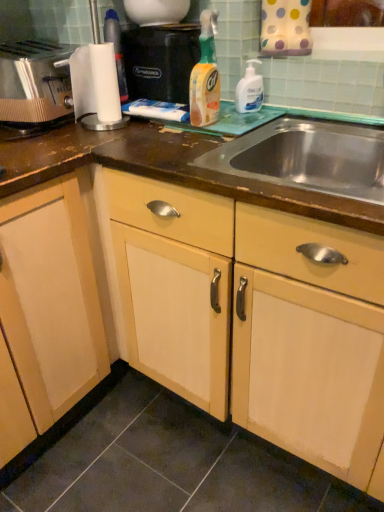
In order to face stainless steel sink at center, should I rotate leftwards or rightwards?

You should look right and rotate roughly 16.664 degrees.

Measure the distance between point (173, 315) and camera.

Point (173, 315) is 3.94 feet from camera.

Describe the element at coordinates (34, 82) in the screenshot. I see `brushed metal toaster at left` at that location.

What do you see at coordinates (160, 61) in the screenshot? I see `black plastic coffee machine at upper center` at bounding box center [160, 61].

The height and width of the screenshot is (512, 384). I want to click on white glossy pump bottle at upper right, which ranks as the 2th cleaning product in left-to-right order, so click(250, 90).

At what (x,y) coordinates should I click in order to perform the action: click on stainless steel sink at center. Please return your answer as a coordinate pair (x, y). This screenshot has width=384, height=512. Looking at the image, I should click on (306, 158).

Considering the sizes of translucent plastic spray bottle at center, which is the second cleaning product from right to left, and black plastic coffee machine at upper center in the image, is translucent plastic spray bottle at center, which is the second cleaning product from right to left, taller or shorter than black plastic coffee machine at upper center?

Clearly, translucent plastic spray bottle at center, which is the second cleaning product from right to left, is taller compared to black plastic coffee machine at upper center.

The height and width of the screenshot is (512, 384). What are the coordinates of `coffee machine on the left of translucent plastic spray bottle at center, arranged as the first cleaning product when viewed from the left` in the screenshot? It's located at (160, 61).

Which object is positioned more to the right, translucent plastic spray bottle at center, arranged as the first cleaning product when viewed from the left, or black plastic coffee machine at upper center?

translucent plastic spray bottle at center, arranged as the first cleaning product when viewed from the left.

Considering the positions of objects translucent plastic spray bottle at center, which is the second cleaning product from right to left, and black plastic coffee machine at upper center in the image provided, who is behind, translucent plastic spray bottle at center, which is the second cleaning product from right to left, or black plastic coffee machine at upper center?

black plastic coffee machine at upper center is behind.

Considering the relative sizes of black plastic coffee machine at upper center and brushed metal toaster at left in the image provided, is black plastic coffee machine at upper center wider than brushed metal toaster at left?

Incorrect, the width of black plastic coffee machine at upper center does not surpass that of brushed metal toaster at left.

Could you tell me if black plastic coffee machine at upper center is turned towards brushed metal toaster at left?

No, black plastic coffee machine at upper center is not turned towards brushed metal toaster at left.

Is black plastic coffee machine at upper center positioned before brushed metal toaster at left?

No, it is not.

From the image's perspective, between black plastic coffee machine at upper center and brushed metal toaster at left, who is located below?

brushed metal toaster at left is shown below in the image.

How many degrees apart are the facing directions of matte wood cabinet at center and stainless steel sink at center?

The angular difference between matte wood cabinet at center and stainless steel sink at center is 0.000668 degrees.

Locate an element on the screen. The image size is (384, 512). sink behind the matte wood cabinet at center is located at coordinates (306, 158).

Considering the positions of objects matte wood cabinet at center and stainless steel sink at center in the image provided, who is more to the right, matte wood cabinet at center or stainless steel sink at center?

stainless steel sink at center is more to the right.

Locate an element on the screen. sink in front of the translucent plastic spray bottle at center, which is the second cleaning product from right to left is located at coordinates click(x=306, y=158).

Is stainless steel sink at center aimed at translucent plastic spray bottle at center, arranged as the first cleaning product when viewed from the left?

No, stainless steel sink at center does not turn towards translucent plastic spray bottle at center, arranged as the first cleaning product when viewed from the left.

Considering the positions of objects stainless steel sink at center and translucent plastic spray bottle at center, arranged as the first cleaning product when viewed from the left, in the image provided, who is behind, stainless steel sink at center or translucent plastic spray bottle at center, arranged as the first cleaning product when viewed from the left,?

translucent plastic spray bottle at center, arranged as the first cleaning product when viewed from the left, is behind.

In terms of height, does stainless steel sink at center look taller or shorter compared to translucent plastic spray bottle at center, arranged as the first cleaning product when viewed from the left?

Clearly, stainless steel sink at center is shorter compared to translucent plastic spray bottle at center, arranged as the first cleaning product when viewed from the left.

Who is more distant, white glossy pump bottle at upper right, which ranks as the 2th cleaning product in left-to-right order, or translucent plastic spray bottle at center, which is the second cleaning product from right to left?

white glossy pump bottle at upper right, which ranks as the 2th cleaning product in left-to-right order, is further from the camera.

Is point (237, 103) positioned behind point (203, 114)?

That is True.

Locate an element on the screen. This screenshot has height=512, width=384. cleaning product located in front of the white glossy pump bottle at upper right, acting as the 1th cleaning product starting from the right is located at coordinates pyautogui.click(x=205, y=76).

Is white glossy pump bottle at upper right, acting as the 1th cleaning product starting from the right, facing towards translucent plastic spray bottle at center, which is the second cleaning product from right to left?

Yes, white glossy pump bottle at upper right, acting as the 1th cleaning product starting from the right, is facing translucent plastic spray bottle at center, which is the second cleaning product from right to left.

How different are the orientations of stainless steel sink at center and black plastic coffee machine at upper center in degrees?

They differ by 7.42 degrees in their facing directions.

There is a stainless steel sink at center. Identify the location of coffee machine above it (from a real-world perspective). (160, 61).

Is stainless steel sink at center taller or shorter than black plastic coffee machine at upper center?

stainless steel sink at center is shorter than black plastic coffee machine at upper center.

Which object is wider, stainless steel sink at center or black plastic coffee machine at upper center?

Wider between the two is stainless steel sink at center.

Is point (167, 361) closer to viewer compared to point (210, 96)?

No, it is not.

Based on their positions, is matte wood cabinet at center located to the left or right of translucent plastic spray bottle at center, which is the second cleaning product from right to left?

In the image, matte wood cabinet at center appears on the left side of translucent plastic spray bottle at center, which is the second cleaning product from right to left.

Is matte wood cabinet at center outside of translucent plastic spray bottle at center, which is the second cleaning product from right to left?

Yes.

Is matte wood cabinet at center positioned with its back to translucent plastic spray bottle at center, which is the second cleaning product from right to left?

No, matte wood cabinet at center is not facing the opposite direction of translucent plastic spray bottle at center, which is the second cleaning product from right to left.

Locate an element on the screen. coffee machine that is behind the translucent plastic spray bottle at center, which is the second cleaning product from right to left is located at coordinates (160, 61).

Image resolution: width=384 pixels, height=512 pixels. Find the location of `coffee machine above the brushed metal toaster at left (from the image's perspective)`. coffee machine above the brushed metal toaster at left (from the image's perspective) is located at coordinates (160, 61).

Considering their positions, is brushed metal toaster at left positioned further to white glossy pump bottle at upper right, acting as the 1th cleaning product starting from the right, than matte wood cabinet at center?

matte wood cabinet at center is positioned further to the anchor white glossy pump bottle at upper right, acting as the 1th cleaning product starting from the right.

Which object lies nearer to the anchor point translucent plastic spray bottle at center, arranged as the first cleaning product when viewed from the left, matte wood cabinet at center or brushed metal toaster at left?

brushed metal toaster at left lies closer to translucent plastic spray bottle at center, arranged as the first cleaning product when viewed from the left, than the other object.

Considering their positions, is stainless steel sink at center positioned further to black plastic coffee machine at upper center than brushed metal toaster at left?

Among the two, stainless steel sink at center is located further to black plastic coffee machine at upper center.

Considering their positions, is white glossy pump bottle at upper right, acting as the 1th cleaning product starting from the right, positioned further to black plastic coffee machine at upper center than matte wood cabinet at center?

Among the two, matte wood cabinet at center is located further to black plastic coffee machine at upper center.

From the image, which object appears to be nearer to brushed metal toaster at left, stainless steel sink at center or matte wood cabinet at center?

The object closer to brushed metal toaster at left is stainless steel sink at center.

From the image, which object appears to be nearer to brushed metal toaster at left, stainless steel sink at center or white glossy pump bottle at upper right, acting as the 1th cleaning product starting from the right?

Based on the image, white glossy pump bottle at upper right, acting as the 1th cleaning product starting from the right, appears to be nearer to brushed metal toaster at left.

Looking at the image, which one is located closer to matte wood cabinet at center, brushed metal toaster at left or white glossy pump bottle at upper right, acting as the 1th cleaning product starting from the right?

white glossy pump bottle at upper right, acting as the 1th cleaning product starting from the right, is positioned closer to the anchor matte wood cabinet at center.

Looking at the image, which one is located closer to black plastic coffee machine at upper center, translucent plastic spray bottle at center, which is the second cleaning product from right to left, or stainless steel sink at center?

Based on the image, translucent plastic spray bottle at center, which is the second cleaning product from right to left, appears to be nearer to black plastic coffee machine at upper center.

Locate an element on the screen. cleaning product between stainless steel sink at center and white glossy pump bottle at upper right, which ranks as the 2th cleaning product in left-to-right order, from front to back is located at coordinates (205, 76).

Locate an element on the screen. This screenshot has width=384, height=512. cleaning product located between stainless steel sink at center and black plastic coffee machine at upper center in the depth direction is located at coordinates (205, 76).

Identify the location of sink that lies between black plastic coffee machine at upper center and matte wood cabinet at center from top to bottom. (306, 158).

Find the location of a particular element. The image size is (384, 512). cleaning product located between black plastic coffee machine at upper center and white glossy pump bottle at upper right, acting as the 1th cleaning product starting from the right, in the left-right direction is located at coordinates (205, 76).